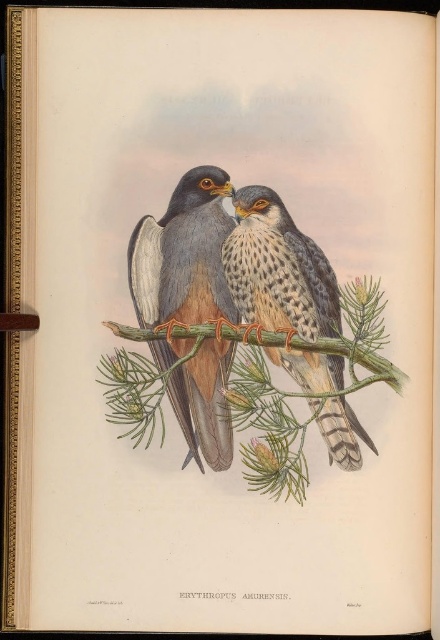
Is point (178, 376) positioned in front of point (318, 275)?

Yes.

The height and width of the screenshot is (640, 440). I want to click on matte blue-gray falcon at center, so click(183, 253).